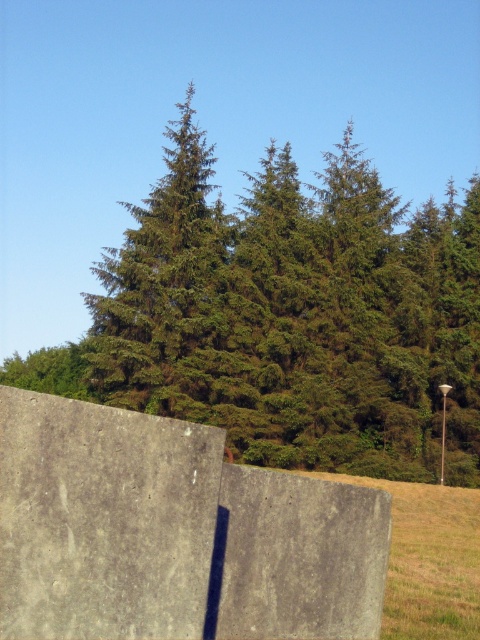
Question: Which point is farther to the camera?

Choices:
 (A) (168, 637)
 (B) (278, 452)
 (C) (467, 589)

Answer: (B)

Question: Where is green matte tree at center located in relation to gray concrete wall at center in the image?

Choices:
 (A) above
 (B) below

Answer: (A)

Question: Considering the relative positions of gray concrete wall at center and yellow-green grass at lower right in the image provided, where is gray concrete wall at center located with respect to yellow-green grass at lower right?

Choices:
 (A) above
 (B) below

Answer: (A)

Question: Which point is farther from the camera taking this photo?

Choices:
 (A) (7, 400)
 (B) (435, 612)
 (C) (7, 372)

Answer: (C)

Question: Which of the following is the farthest from the observer?

Choices:
 (A) (400, 602)
 (B) (448, 404)

Answer: (B)

Question: Does green matte tree at center have a smaller size compared to yellow-green grass at lower right?

Choices:
 (A) yes
 (B) no

Answer: (B)